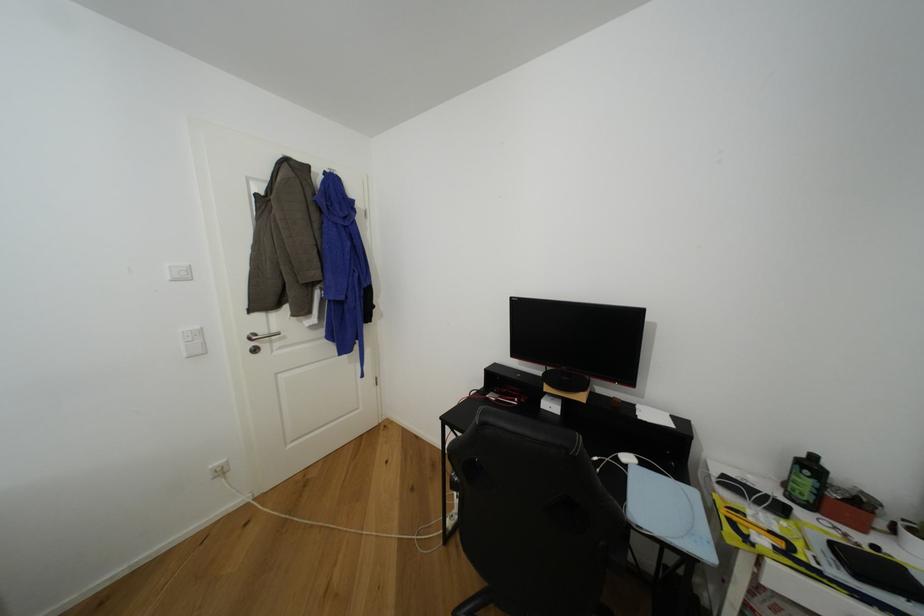
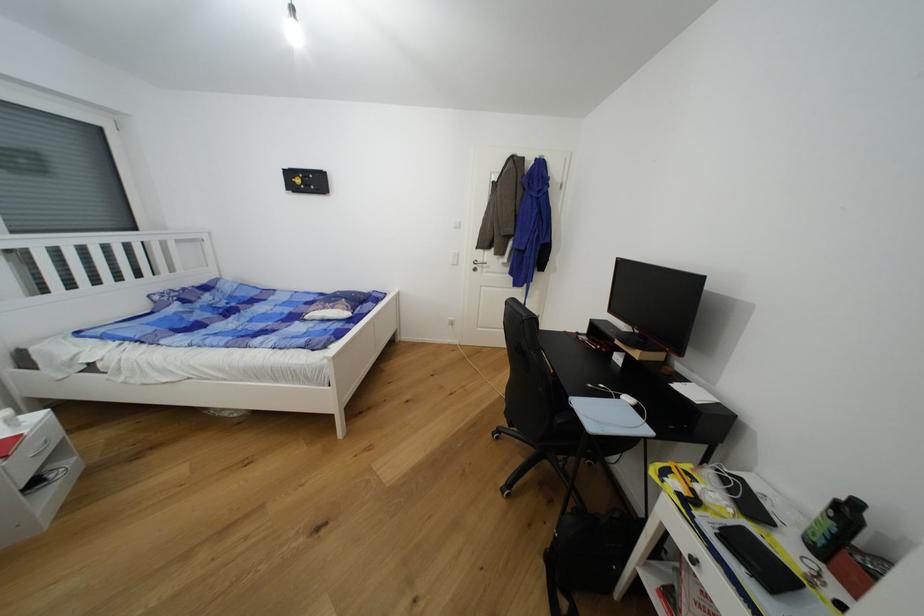
Find the pixel in the second image that matches (x=630, y=467) in the first image.

(623, 399)